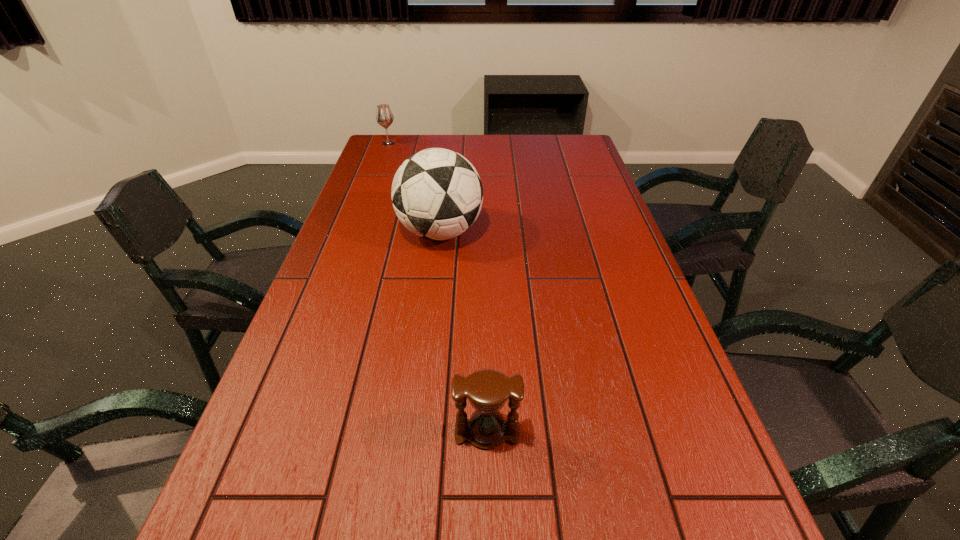
Where is `object that is at the far left corner`? The image size is (960, 540). object that is at the far left corner is located at coordinates (384, 116).

Find the location of a particular element. This screenshot has width=960, height=540. blank space at the far edge of the desktop is located at coordinates (425, 150).

Where is `vacant space at the left edge`? This screenshot has width=960, height=540. vacant space at the left edge is located at coordinates (346, 245).

At what (x,y) coordinates should I click in order to perform the action: click on free space at the right edge of the desktop. Please return your answer as a coordinate pair (x, y). The height and width of the screenshot is (540, 960). Looking at the image, I should click on (570, 225).

I want to click on free space at the far right corner of the desktop, so click(564, 151).

You are a GUI agent. You are given a task and a screenshot of the screen. Output one action in this format:
    pyautogui.click(x=<x>, y=<y>)
    Task: Click on the vacant space that is in between the hourglass and the second farthest object
    
    Given the screenshot: What is the action you would take?
    pyautogui.click(x=464, y=332)

Where is `free spot between the nearest object and the leftmost object`? free spot between the nearest object and the leftmost object is located at coordinates (438, 288).

Locate an element on the screen. free space between the tallest object and the hourglass is located at coordinates (464, 332).

I want to click on blank region between the hourglass and the tallest object, so click(x=464, y=332).

Find the location of `vacant space that is in between the hourglass and the soccer ball`. vacant space that is in between the hourglass and the soccer ball is located at coordinates (464, 332).